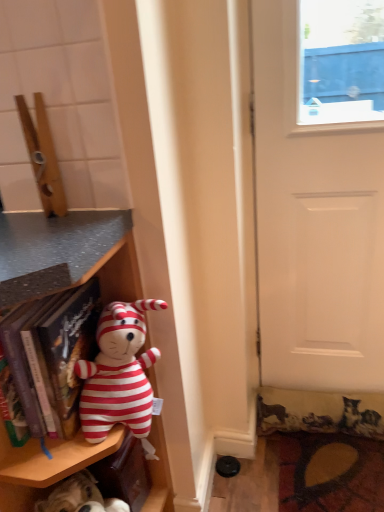
Locate an element on the screen. The image size is (384, 512). vacant area on top of fluffy carpet at lower right (from a real-world perspective) is located at coordinates (336, 467).